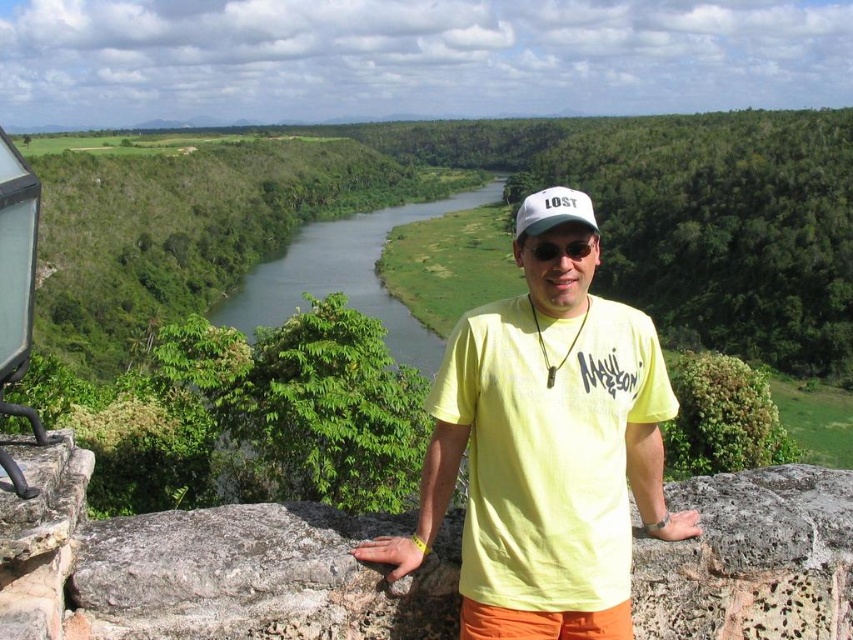
Question: Among these points, which one is farthest from the camera?

Choices:
 (A) (273, 323)
 (B) (524, 513)

Answer: (A)

Question: Is the position of yellow cotton t-shirt at center more distant than that of white fabric baseball cap at center?

Choices:
 (A) yes
 (B) no

Answer: (B)

Question: Considering the relative positions of green smooth river at center and white fabric baseball cap at center in the image provided, where is green smooth river at center located with respect to white fabric baseball cap at center?

Choices:
 (A) below
 (B) above

Answer: (B)

Question: Can you confirm if yellow cotton t-shirt at center is positioned below white fabric baseball cap at center?

Choices:
 (A) yes
 (B) no

Answer: (A)

Question: Which point is closer to the camera taking this photo?

Choices:
 (A) (380, 310)
 (B) (440, 413)

Answer: (B)

Question: Among these points, which one is farthest from the camera?

Choices:
 (A) (474, 524)
 (B) (517, 220)
 (C) (404, 339)

Answer: (C)